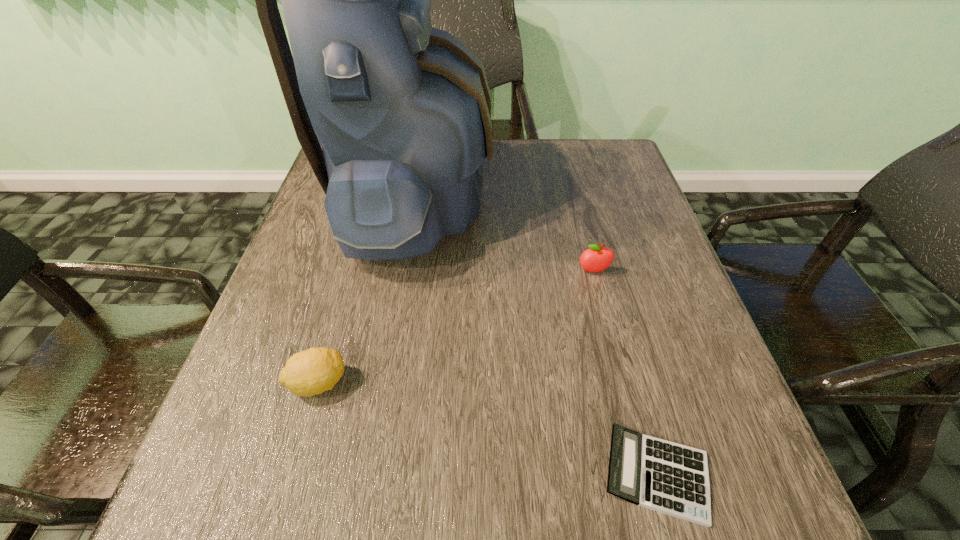
This screenshot has height=540, width=960. Identify the location of free region at the right edge of the desktop. (636, 197).

At what (x,y) coordinates should I click in order to perform the action: click on free location at the near left corner of the desktop. Please return your answer as a coordinate pair (x, y). The height and width of the screenshot is (540, 960). Looking at the image, I should click on (204, 481).

Identify the location of free space at the far right corner of the desktop. (580, 144).

Where is `vacant point located between the nearest object and the tallest object`? vacant point located between the nearest object and the tallest object is located at coordinates (536, 336).

Where is `unoccupied area between the apple and the backpack`? The image size is (960, 540). unoccupied area between the apple and the backpack is located at coordinates (504, 235).

Where is `vacant area that lies between the apple and the tallest object`? vacant area that lies between the apple and the tallest object is located at coordinates (504, 235).

What are the coordinates of `unoccupied position between the calculator and the backpack` in the screenshot? It's located at (536, 336).

Locate an element on the screen. empty space between the backpack and the apple is located at coordinates (504, 235).

Find the location of a particular element. vacant region between the tallest object and the apple is located at coordinates (504, 235).

I want to click on free space between the lemon and the apple, so click(456, 327).